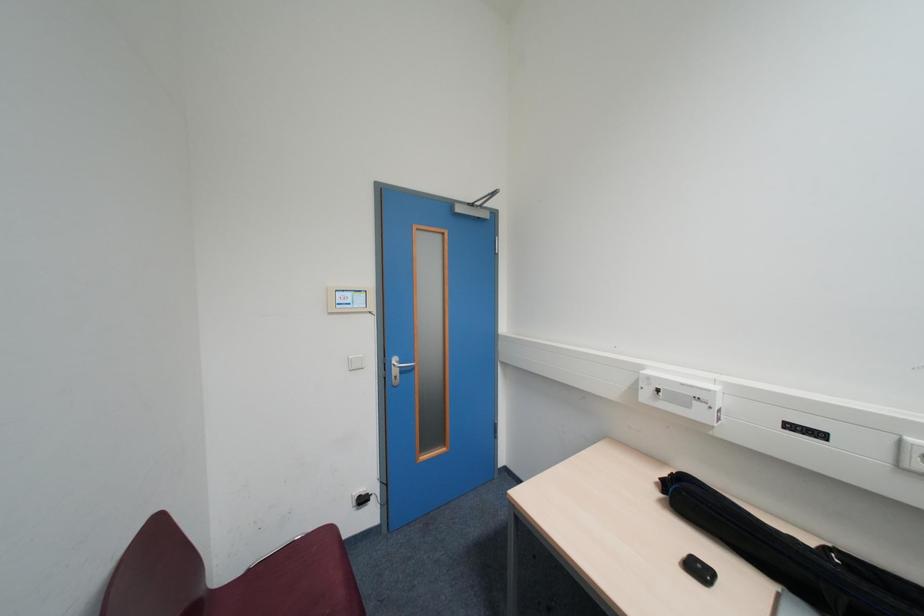
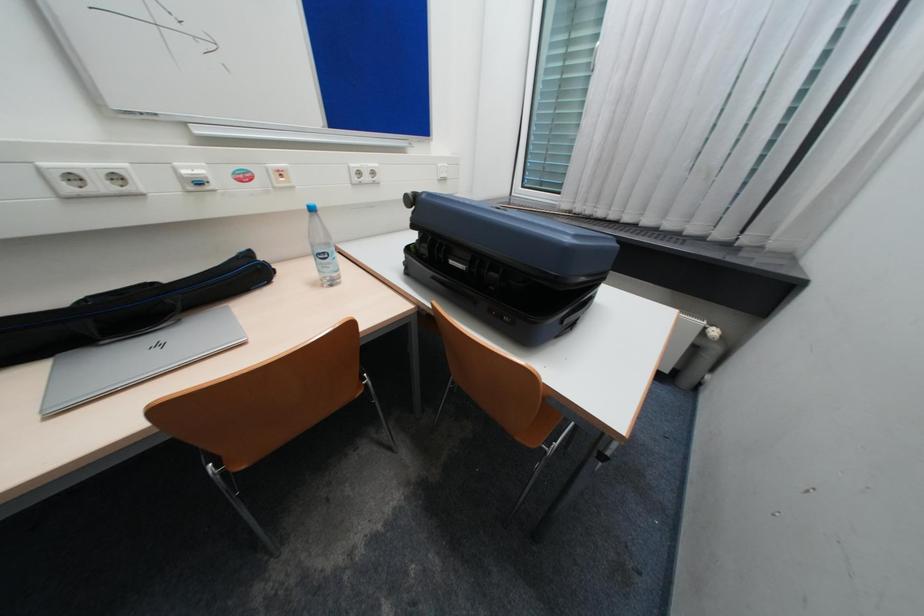
Based on the continuous images, in which direction is the camera rotating?

The camera rotated toward right-down.